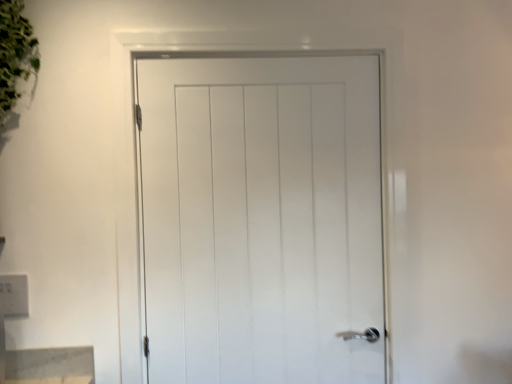
The image size is (512, 384). Identify the location of white wooden door at center. (262, 218).

What is the approximate width of white wooden door at center?

The width of white wooden door at center is 3.03 inches.

What do you see at coordinates (262, 218) in the screenshot?
I see `white wooden door at center` at bounding box center [262, 218].

I want to click on white wooden door at center, so click(262, 218).